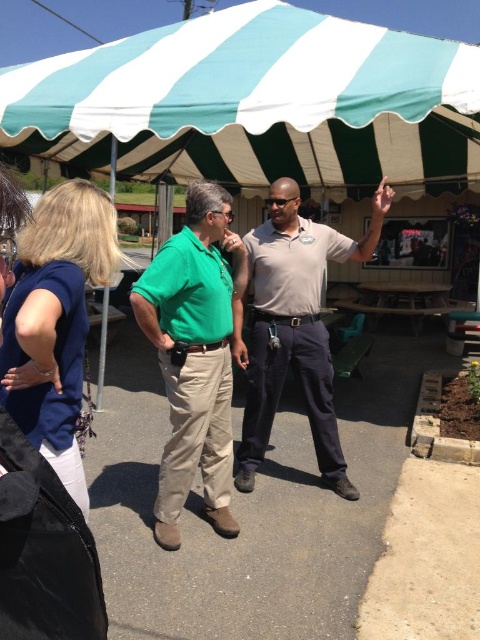
Question: Which of the following is the farthest from the observer?

Choices:
 (A) teal/white striped canopy at upper center
 (B) matte khaki pants at center
 (C) green cotton shirt at center

Answer: (A)

Question: Can you confirm if green cotton shirt at center is positioned below matte khaki pants at center?

Choices:
 (A) yes
 (B) no

Answer: (A)

Question: Which of the following is the closest to the observer?

Choices:
 (A) teal/white striped canopy at upper center
 (B) green cotton shirt at center

Answer: (B)

Question: Which of the following is the farthest from the observer?

Choices:
 (A) green cotton shirt at center
 (B) teal/white striped canopy at upper center

Answer: (B)

Question: Can you confirm if green cotton shirt at center is positioned to the right of matte khaki pants at center?

Choices:
 (A) no
 (B) yes

Answer: (A)

Question: Does green cotton shirt at center come in front of matte khaki pants at center?

Choices:
 (A) yes
 (B) no

Answer: (A)